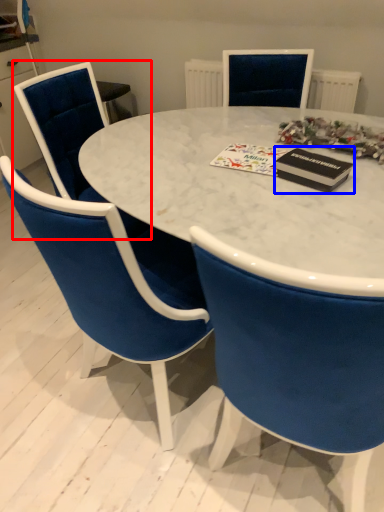
Question: Which of the following is the farthest to the observer, chair (highlighted by a red box) or magazine (highlighted by a blue box)?

Choices:
 (A) chair
 (B) magazine

Answer: (A)